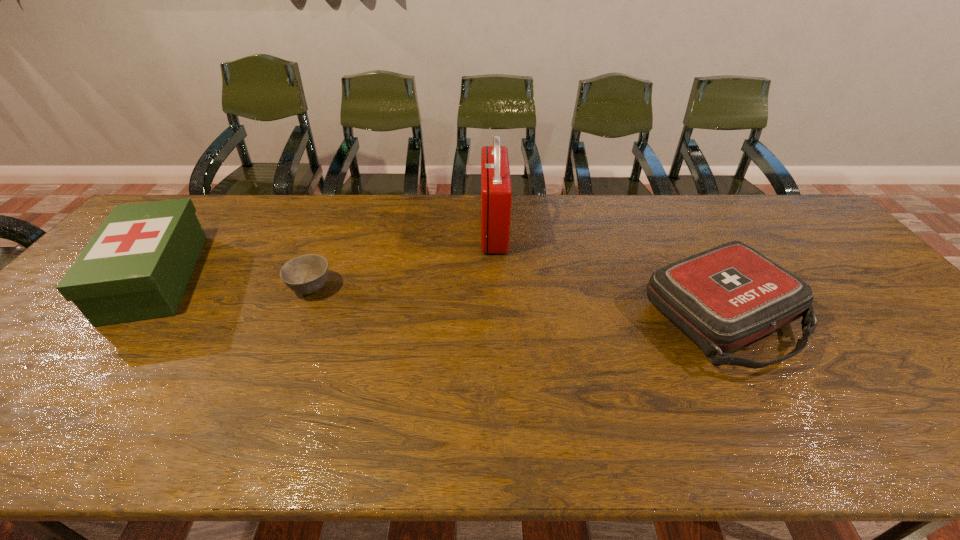
At what (x,y) coordinates should I click in order to perform the action: click on the third object from left to right. Please return your answer as a coordinate pair (x, y). Looking at the image, I should click on (x=496, y=193).

At what (x,y) coordinates should I click in order to perform the action: click on the tallest first-aid kit. Please return your answer as a coordinate pair (x, y). The image size is (960, 540). Looking at the image, I should click on (496, 193).

Locate an element on the screen. This screenshot has width=960, height=540. the second shortest first-aid kit is located at coordinates (137, 265).

I want to click on the second tallest object, so click(137, 265).

Find the location of `the rightmost first-aid kit`. the rightmost first-aid kit is located at coordinates pyautogui.click(x=723, y=298).

This screenshot has width=960, height=540. I want to click on the third tallest object, so click(x=723, y=298).

Identify the location of bowl. (306, 274).

In order to click on the second object from left to right in this screenshot , I will do `click(306, 274)`.

You are a GUI agent. You are given a task and a screenshot of the screen. Output one action in this format:
    pyautogui.click(x=<x>, y=<y>)
    Task: Click on the free point located on the front face of the tallest first-aid kit
    
    Given the screenshot: What is the action you would take?
    tap(360, 229)

Image resolution: width=960 pixels, height=540 pixels. Find the location of `vacant space located on the front face of the tallest first-aid kit`. vacant space located on the front face of the tallest first-aid kit is located at coordinates (422, 229).